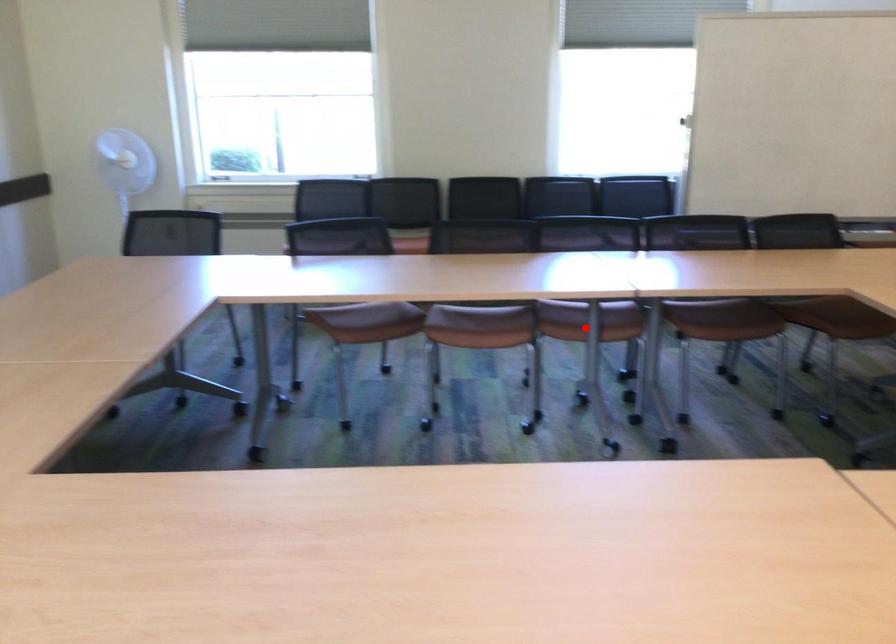
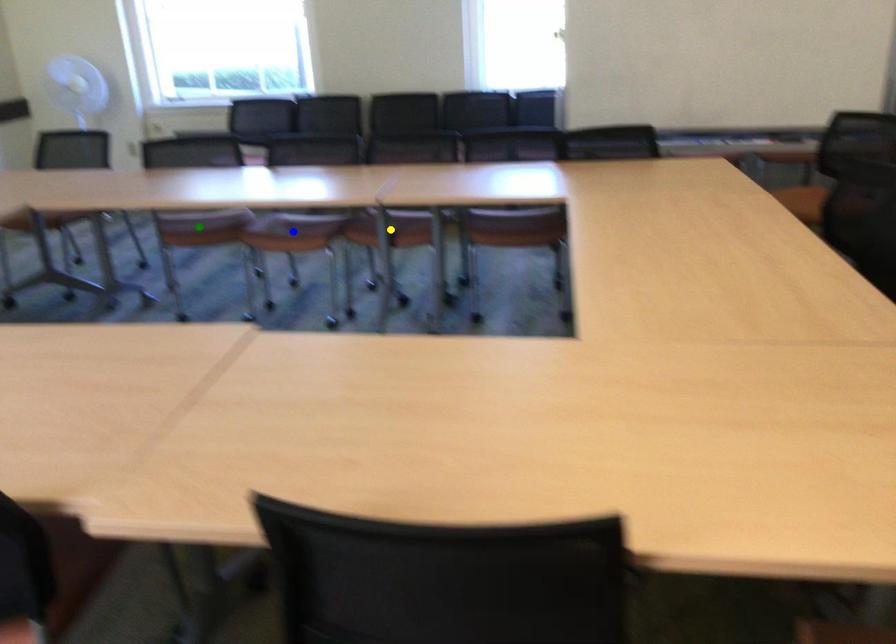
Question: I am providing you with two images of the same scene from different viewpoints. A red point is marked on the first image. You are given multiple points on the second image. Which point in image 2 represents the same 3d spot as the red point in image 1?

Choices:
 (A) green point
 (B) yellow point
 (C) blue point

Answer: (B)